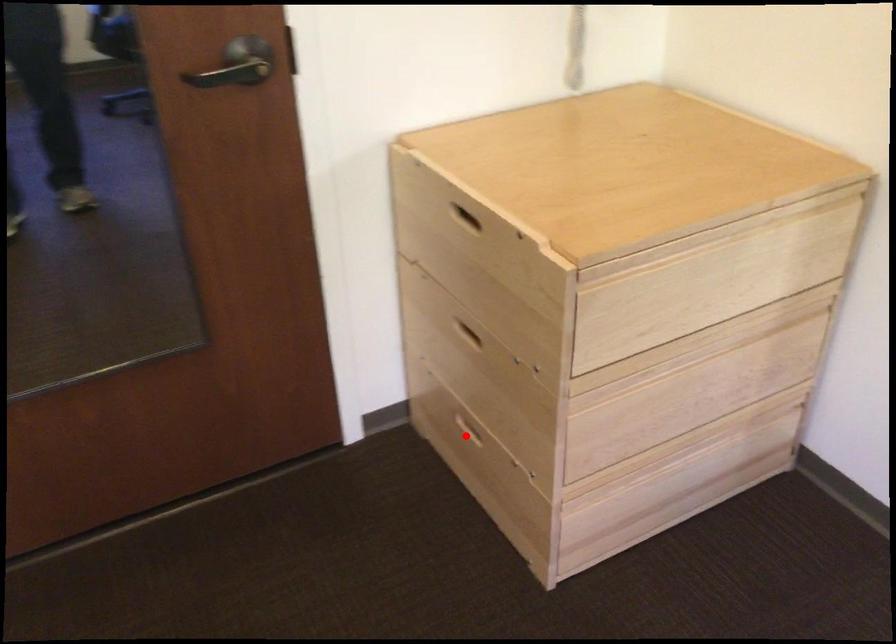
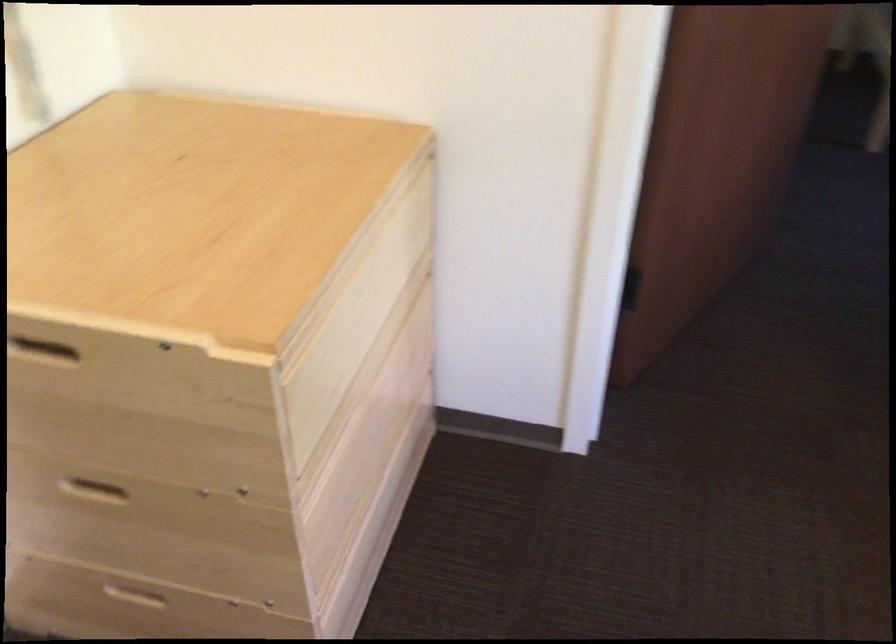
Locate, in the second image, the point that corresponds to the highlighted location in the first image.

(135, 600)